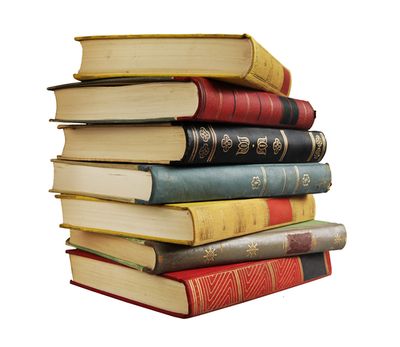
Where is `book`? The image size is (400, 347). book is located at coordinates (219, 56), (175, 95), (156, 141), (129, 183), (154, 226), (140, 249), (146, 291).